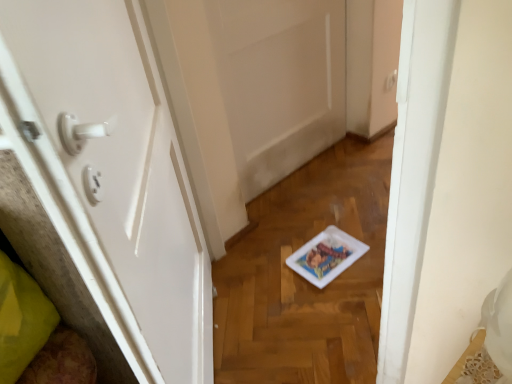
Question: Based on their positions, is white matte door at center, marked as the 2th door in a front-to-back arrangement, located to the left or right of white glossy door at left, which is the 2th door from back to front?

Choices:
 (A) left
 (B) right

Answer: (B)

Question: From the image's perspective, is white matte door at center, the 1th door when ordered from back to front, positioned above or below white glossy door at left, which is the 2th door from back to front?

Choices:
 (A) below
 (B) above

Answer: (B)

Question: From a real-world perspective, relative to white glossy door at left, which is the 2th door from back to front, is white matte door at center, marked as the 2th door in a front-to-back arrangement, vertically above or below?

Choices:
 (A) above
 (B) below

Answer: (B)

Question: Does point (79, 258) appear closer or farther from the camera than point (278, 51)?

Choices:
 (A) farther
 (B) closer

Answer: (B)

Question: In the image, is white glossy door at left, arranged as the 1th door when viewed from the front, positioned in front of or behind white matte door at center, the 1th door when ordered from back to front?

Choices:
 (A) front
 (B) behind

Answer: (A)

Question: From the image's perspective, is white glossy door at left, which is the 2th door from back to front, positioned above or below white matte door at center, the 1th door when ordered from back to front?

Choices:
 (A) above
 (B) below

Answer: (B)

Question: Is white glossy door at left, which is the 2th door from back to front, wider or thinner than white matte door at center, marked as the 2th door in a front-to-back arrangement?

Choices:
 (A) thin
 (B) wide

Answer: (B)